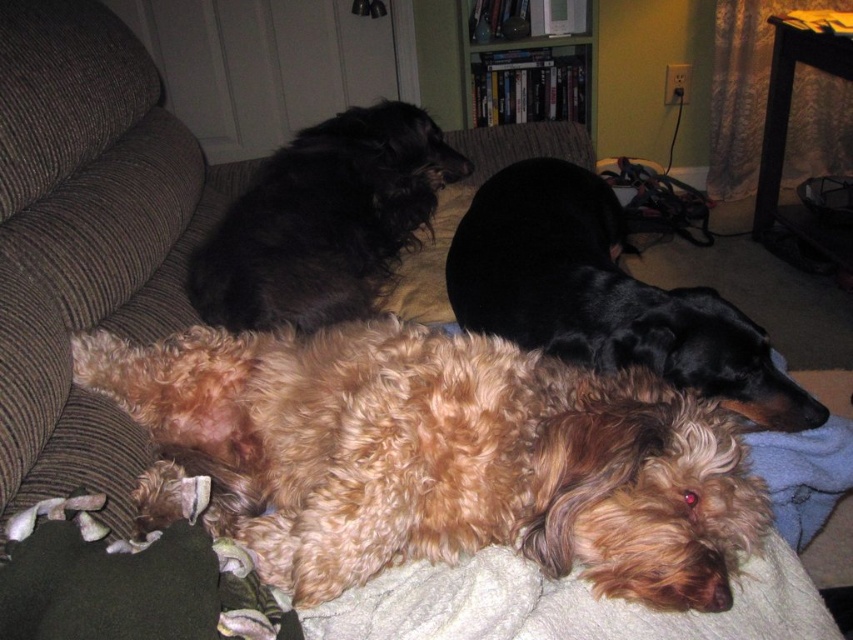
Is shiny black fur at upper left to the right of black fabric pillow at upper center from the viewer's perspective?

No, shiny black fur at upper left is not to the right of black fabric pillow at upper center.

Is point (317, 177) positioned after point (422, 243)?

No, it is not.

Who is more forward, (373,216) or (471,196)?

Point (373,216) is in front.

At what (x,y) coordinates should I click in order to perform the action: click on shiny black fur at upper left. Please return your answer as a coordinate pair (x, y). This screenshot has width=853, height=640. Looking at the image, I should click on (323, 221).

The width and height of the screenshot is (853, 640). Describe the element at coordinates (434, 458) in the screenshot. I see `fuzzy brown dog at center` at that location.

Does fuzzy brown dog at center have a lesser height compared to black silky dog at center?

Yes, fuzzy brown dog at center is shorter than black silky dog at center.

At what (x,y) coordinates should I click in order to perform the action: click on fuzzy brown dog at center. Please return your answer as a coordinate pair (x, y). The width and height of the screenshot is (853, 640). Looking at the image, I should click on [x=434, y=458].

The image size is (853, 640). In order to click on fuzzy brown dog at center in this screenshot , I will do `click(434, 458)`.

Who is taller, fuzzy brown dog at center or shiny black fur at upper left?

Standing taller between the two is shiny black fur at upper left.

Is point (189, 348) closer to camera compared to point (334, 243)?

Yes, it is in front of point (334, 243).

Image resolution: width=853 pixels, height=640 pixels. What are the coordinates of `fuzzy brown dog at center` in the screenshot? It's located at (434, 458).